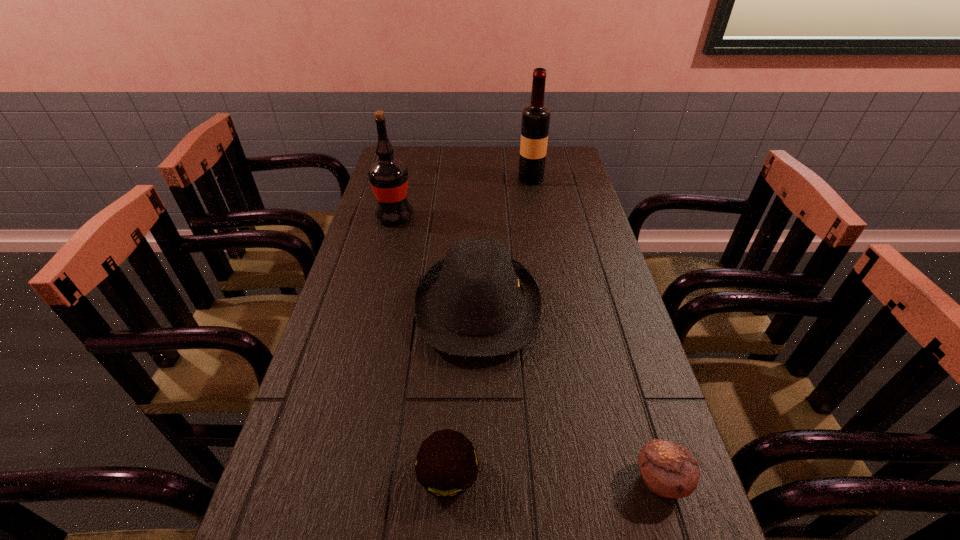
The height and width of the screenshot is (540, 960). In the image, there is a desktop. Find the location of `free space at the right edge`. free space at the right edge is located at coordinates (623, 434).

Where is `free space at the far left corner`? This screenshot has width=960, height=540. free space at the far left corner is located at coordinates (421, 166).

At what (x,y) coordinates should I click in order to perform the action: click on free space at the far right corner of the desktop. Please return your answer as a coordinate pair (x, y). This screenshot has width=960, height=540. Looking at the image, I should click on coord(576,157).

Where is `free spot between the patty and the rightmost object`? This screenshot has height=540, width=960. free spot between the patty and the rightmost object is located at coordinates (554, 477).

At what (x,y) coordinates should I click in order to perform the action: click on free space that is in between the farthest object and the leftmost object. Please return your answer as a coordinate pair (x, y). Looking at the image, I should click on (463, 198).

Find the location of a particular element. The height and width of the screenshot is (540, 960). free space between the third farthest object and the farther wine bottle is located at coordinates (504, 243).

Locate an element on the screen. vacant space that's between the patty and the muffin is located at coordinates (554, 477).

The image size is (960, 540). What are the coordinates of `empty space that is in between the fedora and the patty` in the screenshot? It's located at (463, 391).

Where is `vacant space that's between the fedora and the patty`? The image size is (960, 540). vacant space that's between the fedora and the patty is located at coordinates (463, 391).

At what (x,y) coordinates should I click in order to perform the action: click on vacant region between the right wine bottle and the nearer wine bottle. Please return your answer as a coordinate pair (x, y). This screenshot has height=540, width=960. Looking at the image, I should click on (463, 198).